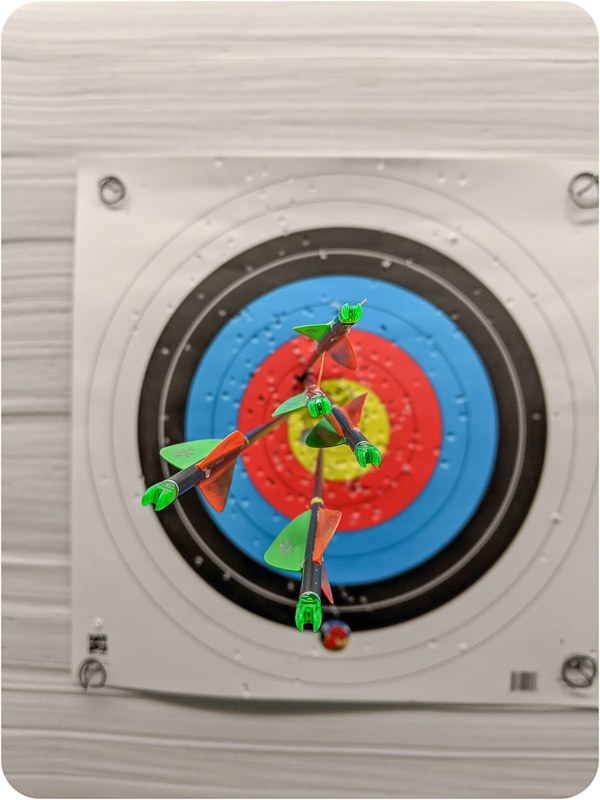
Find the location of `back wall`. back wall is located at coordinates (466, 758), (58, 742), (43, 214), (50, 57), (486, 60), (293, 58).